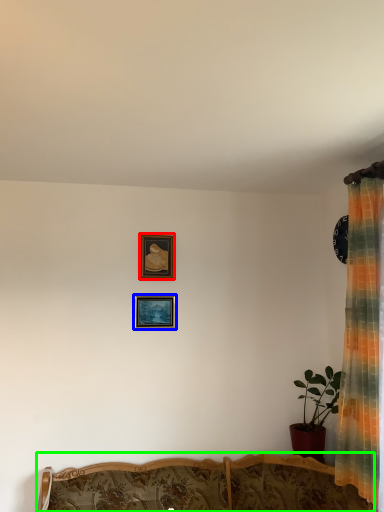
Question: Based on their relative distances, which object is nearer to picture frame (highlighted by a red box)? Choose from picture frame (highlighted by a blue box) and furniture (highlighted by a green box).

Choices:
 (A) picture frame
 (B) furniture

Answer: (A)